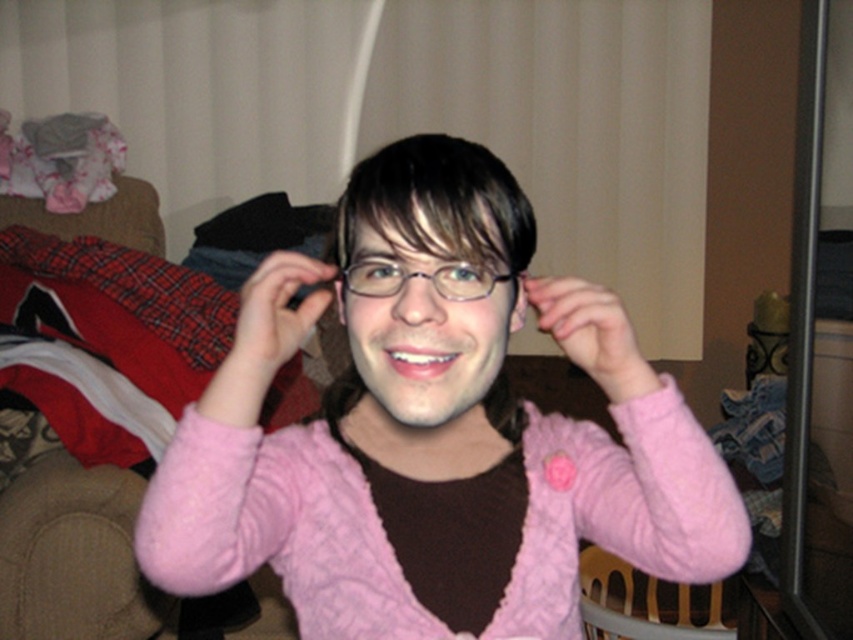
Does pink fuzzy sweater at center have a lesser height compared to matte pink sweater at center?

Incorrect, pink fuzzy sweater at center's height does not fall short of matte pink sweater at center's.

Between pink fuzzy sweater at center and matte pink sweater at center, which one is positioned higher?

matte pink sweater at center is higher up.

What do you see at coordinates (432, 444) in the screenshot? I see `pink fuzzy sweater at center` at bounding box center [432, 444].

Locate an element on the screen. The image size is (853, 640). pink fuzzy sweater at center is located at coordinates (432, 444).

Is point (239, 316) positioned before point (657, 579)?

Yes.

Between matte pink sweater at center and wooden armchair at lower right, which one is positioned higher?

matte pink sweater at center

Measure the distance between point (286, 353) and camera.

Point (286, 353) is 27.29 inches away from camera.

The width and height of the screenshot is (853, 640). I want to click on matte pink sweater at center, so click(x=277, y=310).

Between pink fuzzy hand at center and wooden armchair at lower right, which one has less height?

With less height is pink fuzzy hand at center.

Is point (602, 292) closer to viewer compared to point (602, 605)?

Yes, it is.

The width and height of the screenshot is (853, 640). What do you see at coordinates (590, 332) in the screenshot? I see `pink fuzzy hand at center` at bounding box center [590, 332].

At what (x,y) coordinates should I click in order to perform the action: click on pink fuzzy hand at center. Please return your answer as a coordinate pair (x, y). The image size is (853, 640). Looking at the image, I should click on (590, 332).